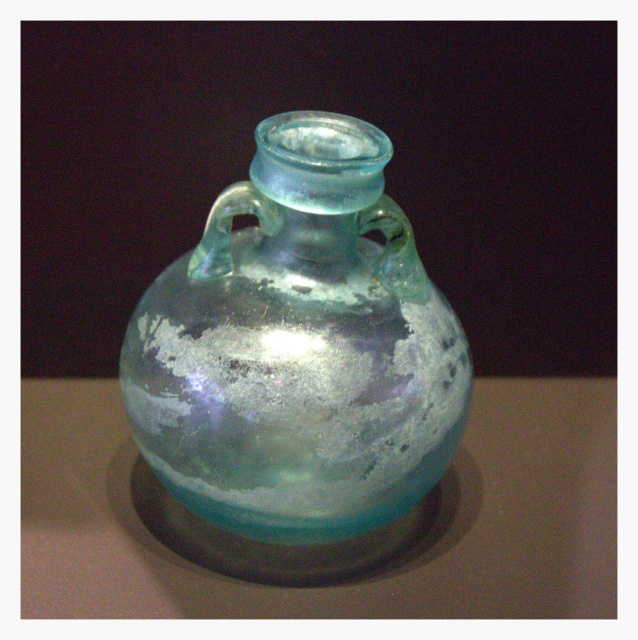
Is translucent glass vase at center bigger than translucent glass jar at center?

No.

Does translucent glass vase at center have a greater width compared to translucent glass jar at center?

No, translucent glass vase at center is not wider than translucent glass jar at center.

The image size is (638, 640). What do you see at coordinates (299, 348) in the screenshot? I see `translucent glass vase at center` at bounding box center [299, 348].

Where is `translucent glass vase at center`? This screenshot has width=638, height=640. translucent glass vase at center is located at coordinates (299, 348).